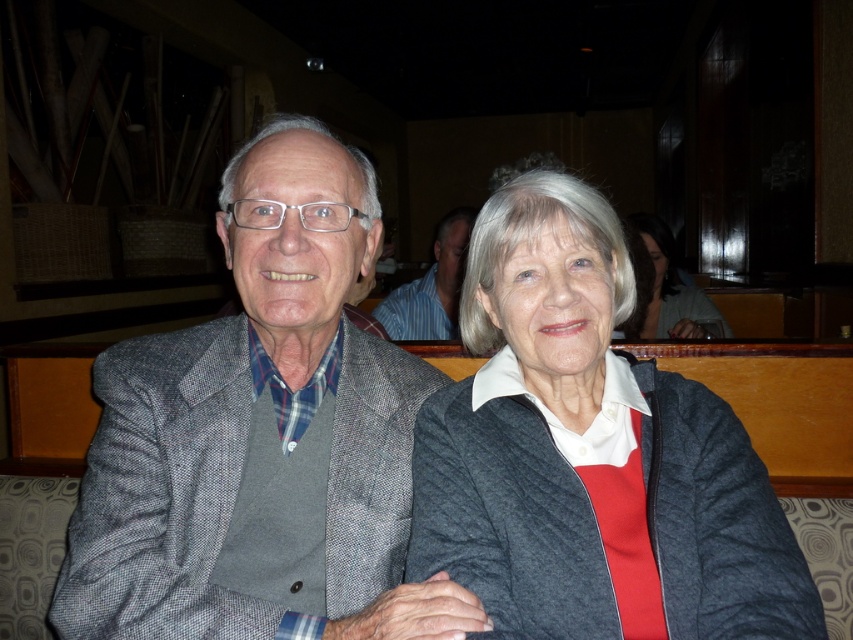
Measure the distance from matte gray sweater at center to striped shirt at center.

31.09 inches

Can you confirm if matte gray sweater at center is positioned to the left of striped shirt at center?

Incorrect, matte gray sweater at center is not on the left side of striped shirt at center.

Which is in front, point (680, 292) or point (415, 300)?

Positioned in front is point (415, 300).

Find the location of `matte gray sweater at center`. matte gray sweater at center is located at coordinates (665, 289).

Does gray woolen suit at center come in front of striped shirt at center?

Yes, gray woolen suit at center is in front of striped shirt at center.

Is gray woolen suit at center thinner than striped shirt at center?

Incorrect, gray woolen suit at center's width is not less than striped shirt at center's.

The image size is (853, 640). Describe the element at coordinates (260, 436) in the screenshot. I see `gray woolen suit at center` at that location.

Identify the location of gray woolen suit at center. (260, 436).

Is matte gray jacket at center shorter than striped shirt at center?

No.

Between matte gray jacket at center and striped shirt at center, which one has less height?

striped shirt at center is shorter.

Between point (692, 595) and point (395, 292), which one is positioned in front?

Point (692, 595)

Where is `matte gray jacket at center`? matte gray jacket at center is located at coordinates (590, 452).